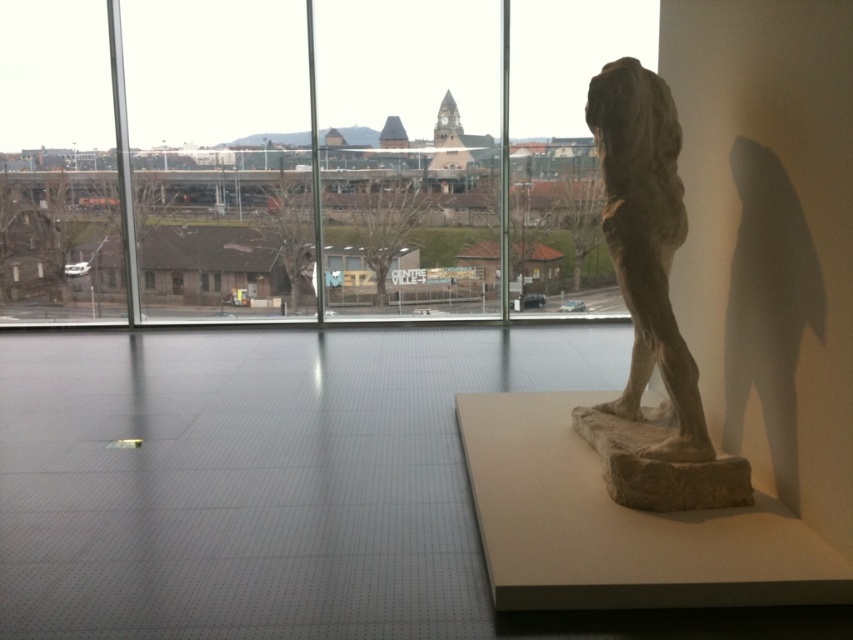
In the scene shown: You are an interior designer assessing the space. You need to place a large potted plant that is 1.2 meters wide between the transparent glass window at center and the stone statue at right. Based on their widths, will the plant fit between them?

The transparent glass window at center is wider than the stone statue at right. Since the plant is 1.2 meters wide, the available space between them depends on their combined widths. However, without specific measurements of the objects, we cannot definitively determine if the plant will fit. Please provide more details about the exact widths of the window and statue.

You are standing in the room looking at the window. There are two points marked on the window glass, one at point (541, 282) and the other at point (625, 406). Which point is closer to your eyes?

Point (541, 282) is further to the camera than point (625, 406), so the point closer to your eyes is point (625, 406).